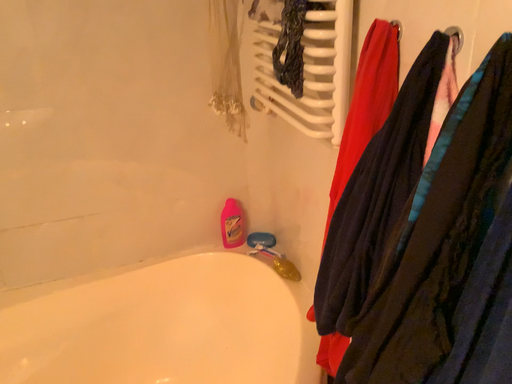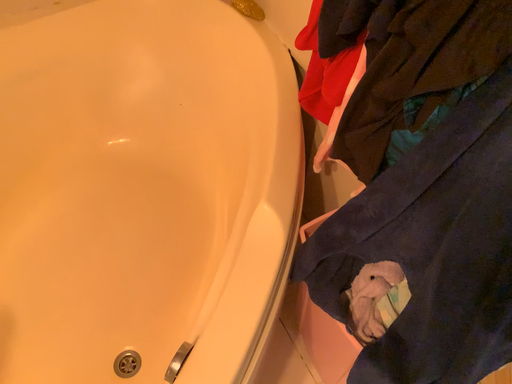
Question: How did the camera likely rotate when shooting the video?

Choices:
 (A) rotated right
 (B) rotated left

Answer: (A)